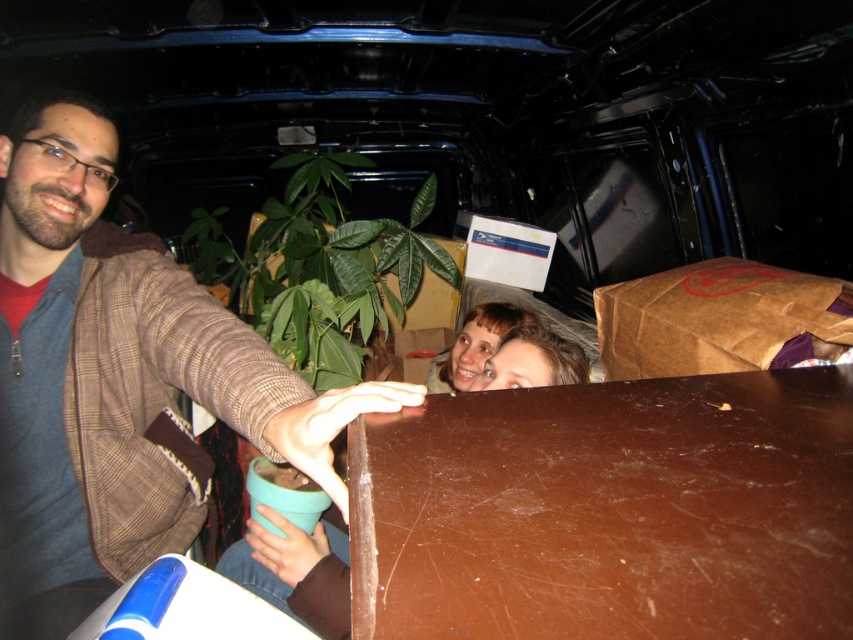
Question: Considering the relative positions of brown paper bag at upper right and smooth skin face at center in the image provided, where is brown paper bag at upper right located with respect to smooth skin face at center?

Choices:
 (A) left
 (B) right

Answer: (B)

Question: Which object is positioned closest to the matte brown hair at center?

Choices:
 (A) smooth brown wooden table at center
 (B) smooth skin face at center

Answer: (B)

Question: Estimate the real-world distances between objects in this image. Which object is closer to the smooth brown wooden table at center?

Choices:
 (A) matte brown hair at center
 (B) brown matte table at center

Answer: (A)

Question: Which of the following is the farthest from the observer?

Choices:
 (A) (311, 589)
 (B) (485, 301)
 (C) (39, 257)

Answer: (B)

Question: Is smooth brown wooden table at center further to the viewer compared to smooth skin face at center?

Choices:
 (A) no
 (B) yes

Answer: (A)

Question: Can you confirm if brown plaid jacket at left is wider than matte brown hair at center?

Choices:
 (A) yes
 (B) no

Answer: (A)